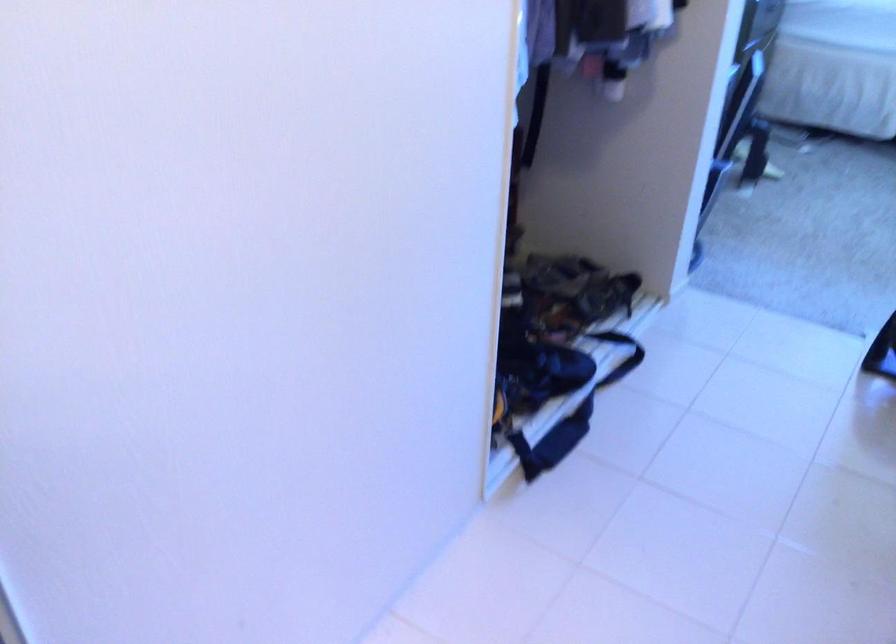
Find the location of a particular element. The image size is (896, 644). black bag strap is located at coordinates (621, 355).